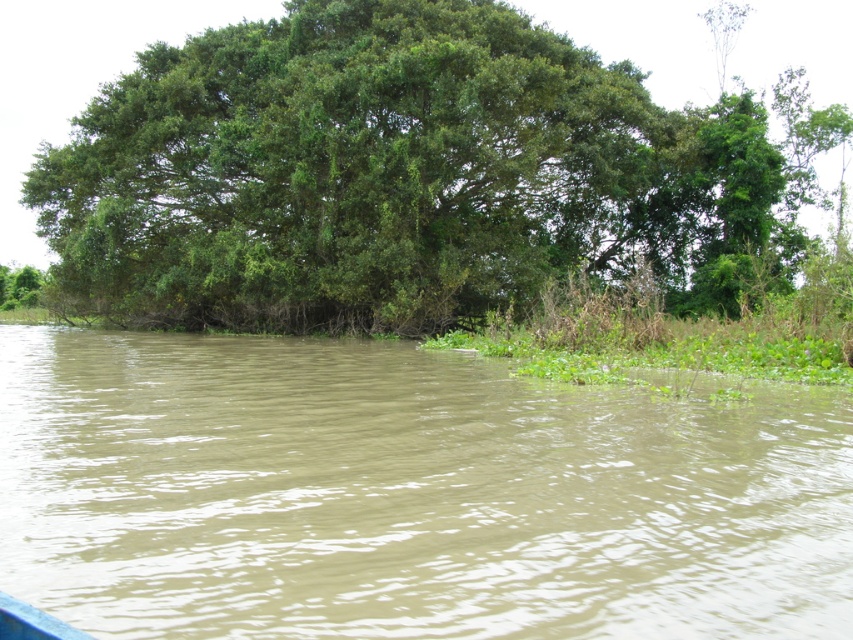
You are standing at the edge of the water and want to take a photo of the green leafy tree at upper center without the brown muddy water at center blocking the view. Is this possible?

The brown muddy water at center is in front of the green leafy tree at upper center, so it will block the view. To take a photo of the green leafy tree at upper center without the brown muddy water at center blocking the view, you need to move to a position where the tree is not behind the water, such as moving further back or to the side to get a clear angle.

You are standing on the bank of the water body and want to observe the brown muddy water at center and the green leafy tree at upper center. Which object is closer to your eye level?

The green leafy tree at upper center is closer to your eye level because it is positioned above the brown muddy water at center, which is located below it.